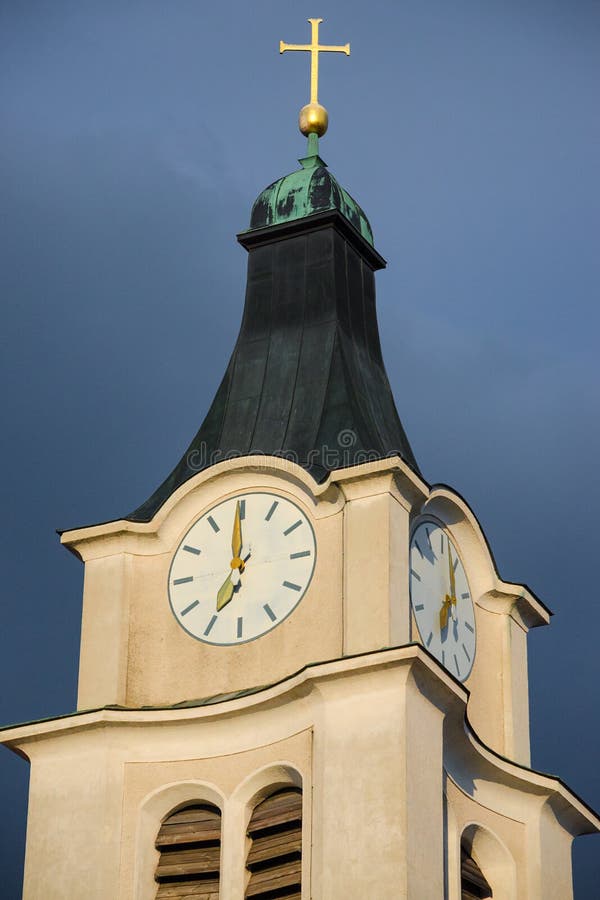
Where is `clocks face`? The image size is (600, 900). clocks face is located at coordinates (266, 580), (430, 595).